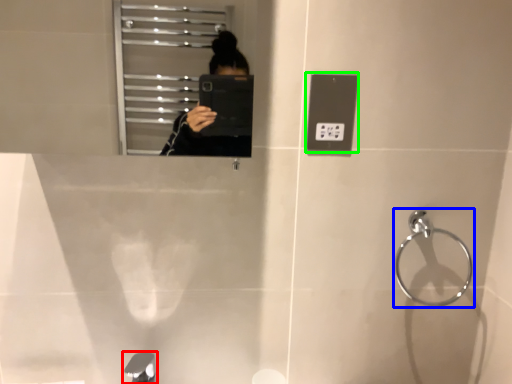
Question: Which object is positioned farthest from tap (highlighted by a red box)? Select from towel bar (highlighted by a blue box) and light switch (highlighted by a green box).

Choices:
 (A) towel bar
 (B) light switch

Answer: (A)